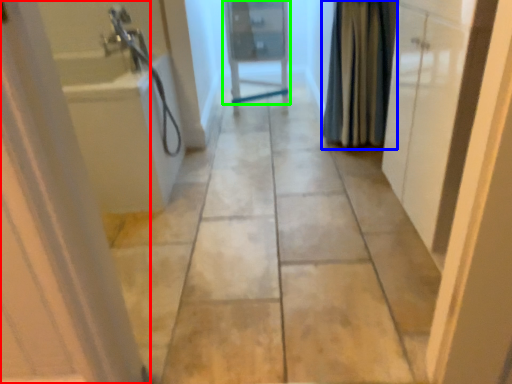
Question: Considering the real-world distances, which object is farthest from door (highlighted by a red box)? shower curtain (highlighted by a blue box) or door (highlighted by a green box)?

Choices:
 (A) shower curtain
 (B) door

Answer: (B)